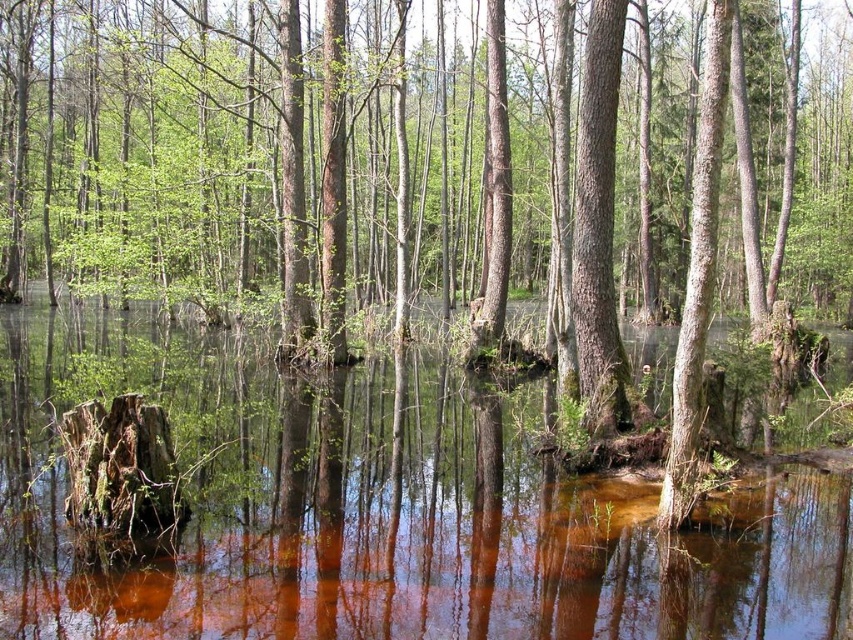
Between point (335, 420) and point (601, 240), which one is positioned behind?

The point (335, 420) is more distant.

Does brown wood at center lie in front of smooth brown tree trunk at center?

Yes, brown wood at center is in front of smooth brown tree trunk at center.

Locate an element on the screen. This screenshot has width=853, height=640. brown wood at center is located at coordinates (393, 516).